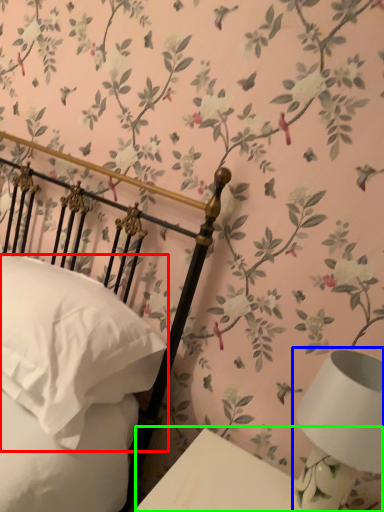
Question: Based on their relative distances, which object is nearer to pillow (highlighted by a red box)? Choose from table lamp (highlighted by a blue box) and table (highlighted by a green box).

Choices:
 (A) table lamp
 (B) table

Answer: (B)